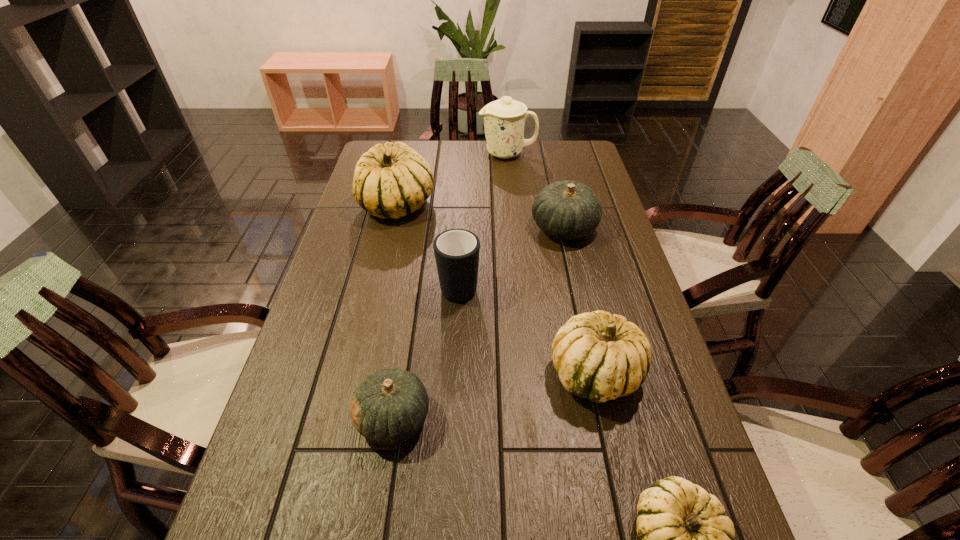
Locate an element on the screen. The height and width of the screenshot is (540, 960). object that stands as the third closest to the fourth nearest object is located at coordinates (599, 356).

I want to click on gourd that is the third nearest to the bigger orange gourd, so click(388, 407).

Where is `the second closest gourd to the farthest object`? The image size is (960, 540). the second closest gourd to the farthest object is located at coordinates (568, 210).

Image resolution: width=960 pixels, height=540 pixels. In order to click on white gourd that is the closest one to the mug in this screenshot , I will do `click(392, 180)`.

Locate which white gourd ranks in proximity to the leftmost white gourd. Please provide its 2D coordinates. Your answer should be formatted as a tuple, i.e. [(x, y)], where the tuple contains the x and y coordinates of a point satisfying the conditions above.

[(599, 356)]

The image size is (960, 540). Identify the location of vacant area that satisfies the following two spatial constraints: 1. on the front side of the farthest white gourd; 2. on the left side of the farther orange gourd. (392, 228).

The height and width of the screenshot is (540, 960). I want to click on free space that satisfies the following two spatial constraints: 1. on the spout of the chinaware; 2. on the left side of the second smallest white gourd, so click(x=528, y=374).